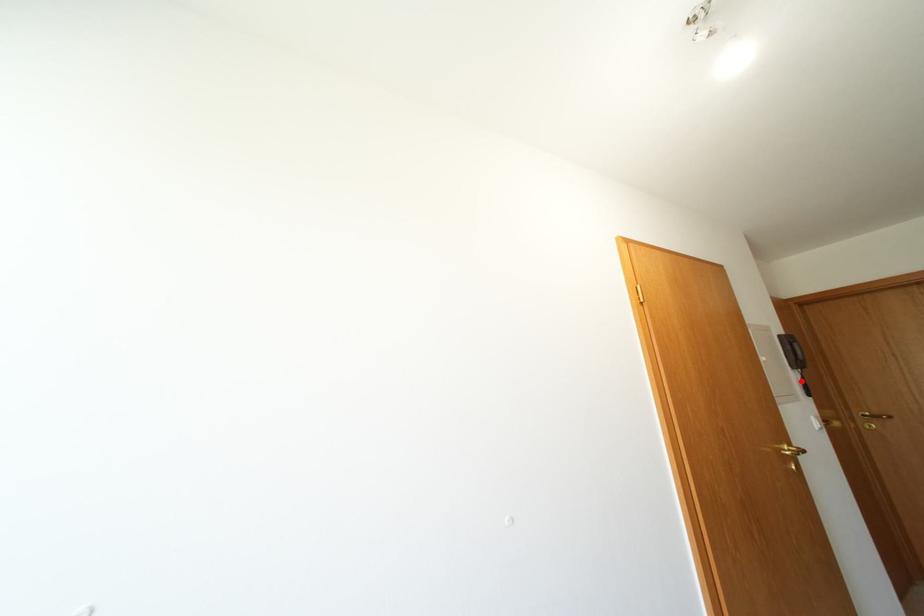
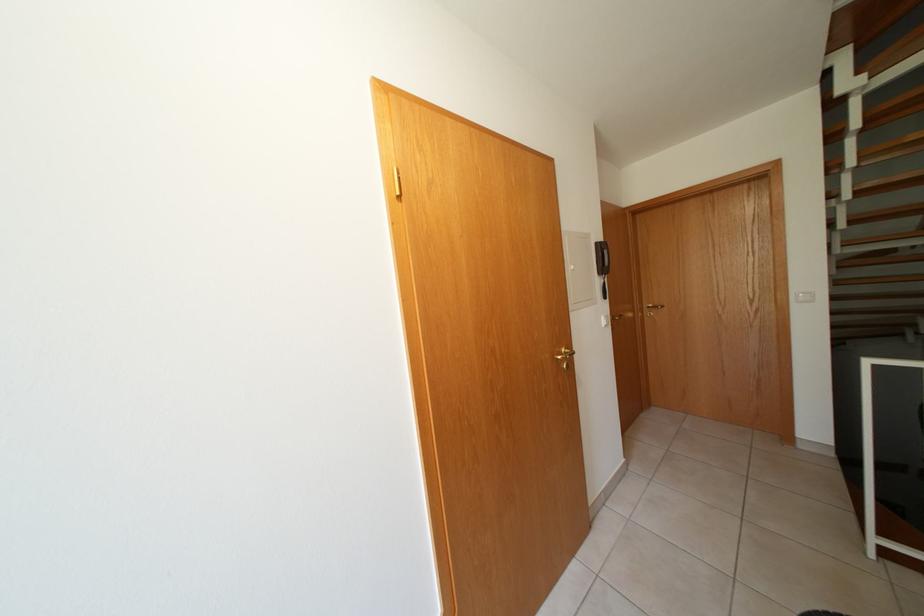
Question: I am providing you with two images of the same scene from different viewpoints. A red point is marked on the first image. Can you still see the location of the red point in image 2?

Choices:
 (A) Yes
 (B) No

Answer: (A)